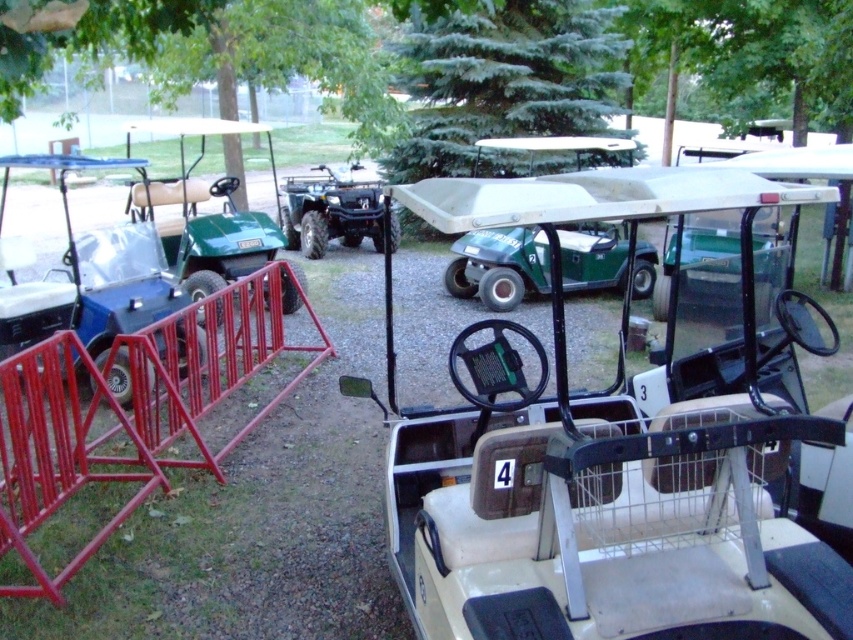
You are standing in the parking area and need to find the white matte golf cart at center. Which direction should you look relative to the matte black golf cart at left?

The white matte golf cart at center is located below the matte black golf cart at left, so you should look downward from the matte black golf cart at left to find it.

You are standing in the parking area and want to locate two specific points marked in the image. The first point is at coordinate (715,500) and the second is at (65,300). Which of these points is nearer to you?

Point (715,500) is closer to the viewer than point (65,300).

You are driving a golf cart that is 1.5 meters wide and need to park it in the parking area. The parking spot you want is between the white matte golf cart at center and the green matte golf cart at left. Can your golf cart fit in that space?

The white matte golf cart at center is narrower than the green matte golf cart at left. The available space between them would depend on their combined widths. However, since the white matte golf cart at center is less wide than the green one, the total space between them may vary. Without exact measurements, it is uncertain if the 1.5 meter wide golf cart can fit. Please check the actual space before parking.